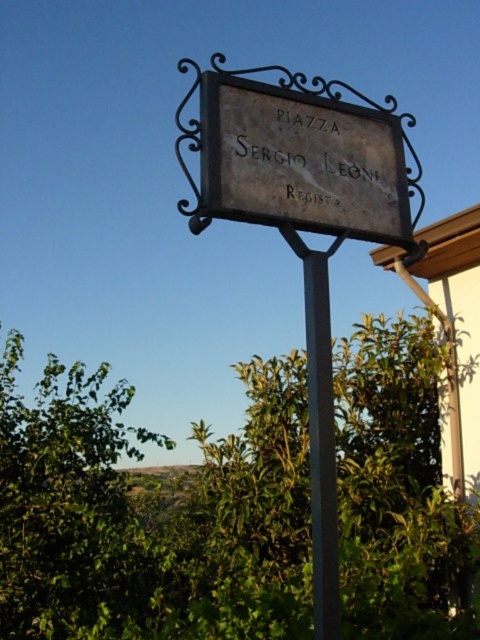
Question: Is dark gray stone sign at center to the left of metallic pole at center from the viewer's perspective?

Choices:
 (A) yes
 (B) no

Answer: (A)

Question: Does dark gray metal sign at center appear over metallic pole at center?

Choices:
 (A) yes
 (B) no

Answer: (A)

Question: Estimate the real-world distances between objects in this image. Which object is farther from the metallic pole at center?

Choices:
 (A) dark gray stone sign at center
 (B) dark gray metal sign at center

Answer: (A)

Question: Does dark gray metal sign at center appear on the left side of metallic pole at center?

Choices:
 (A) yes
 (B) no

Answer: (B)

Question: Which object is positioned closest to the metallic pole at center?

Choices:
 (A) dark gray stone sign at center
 (B) dark gray metal sign at center

Answer: (B)

Question: Which of the following is the closest to the observer?

Choices:
 (A) metallic pole at center
 (B) dark gray stone sign at center

Answer: (A)